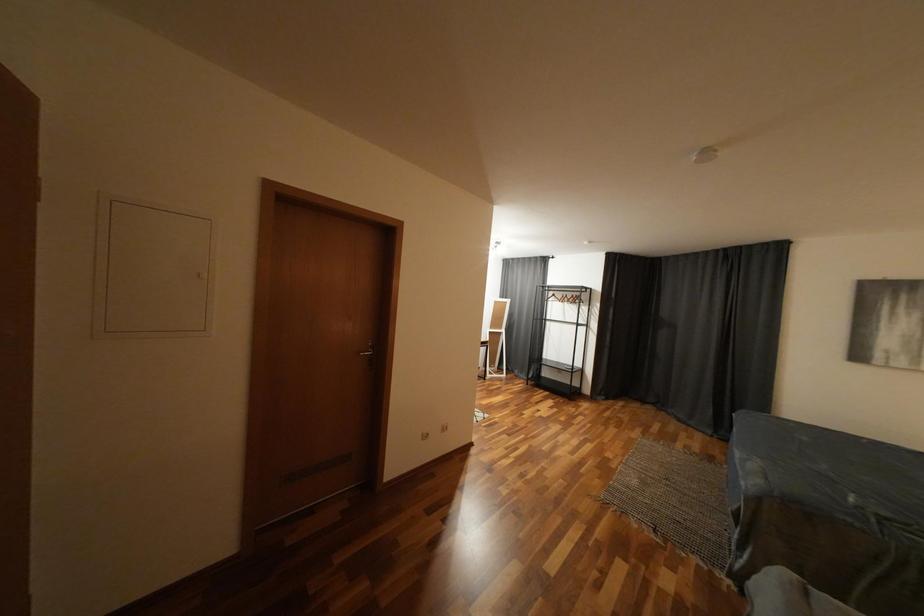
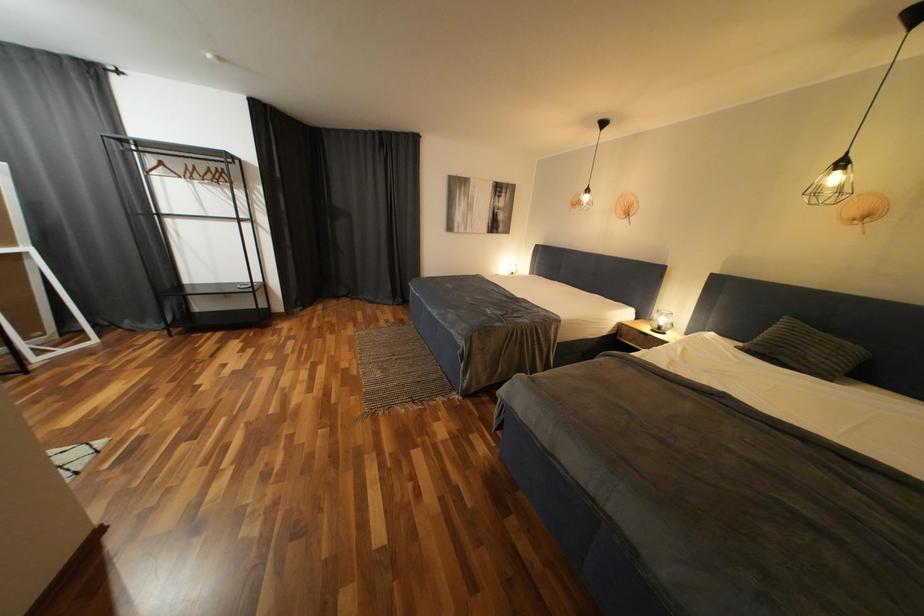
How did the camera likely rotate?

The rotation direction of the camera is right-down.